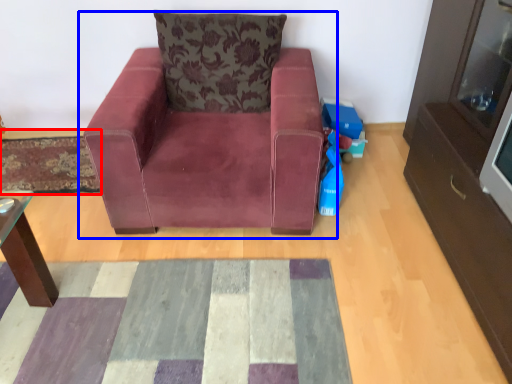
Question: Which object appears closest to the camera in this image, mat (highlighted by a red box) or chair (highlighted by a blue box)?

Choices:
 (A) mat
 (B) chair

Answer: (B)